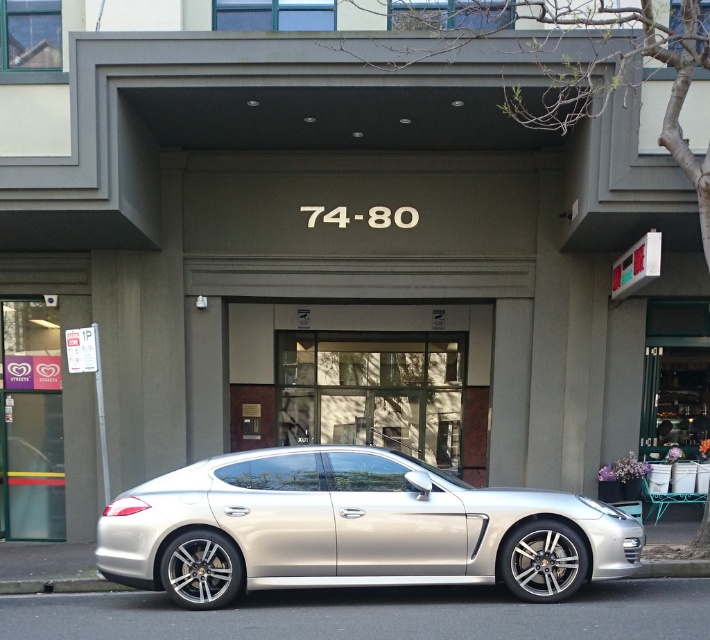
Can you confirm if silver metallic car at center is smaller than clear glass door at center?

Indeed, silver metallic car at center has a smaller size compared to clear glass door at center.

Between point (223, 548) and point (365, 429), which one is positioned in front?

Point (223, 548) is more forward.

The image size is (710, 640). What do you see at coordinates (351, 529) in the screenshot? I see `silver metallic car at center` at bounding box center [351, 529].

Locate an element on the screen. The image size is (710, 640). silver metallic car at center is located at coordinates (351, 529).